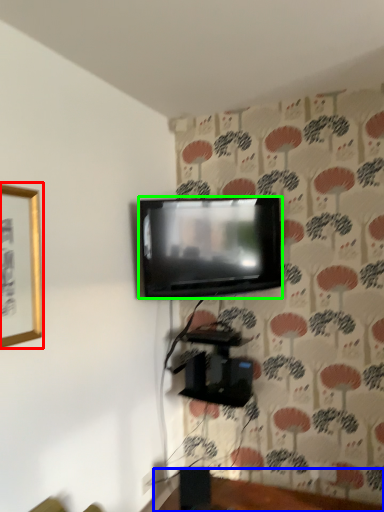
Question: Which object is the farthest from picture frame (highlighted by a red box)? Choose among these: furniture (highlighted by a blue box) or television (highlighted by a green box).

Choices:
 (A) furniture
 (B) television

Answer: (A)